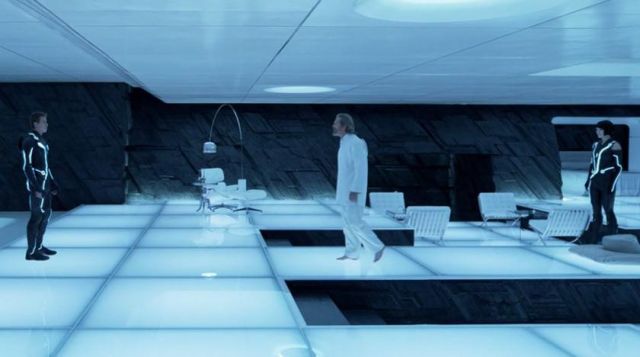
Find the location of a particular element. The image size is (640, 357). light is located at coordinates (209, 147).